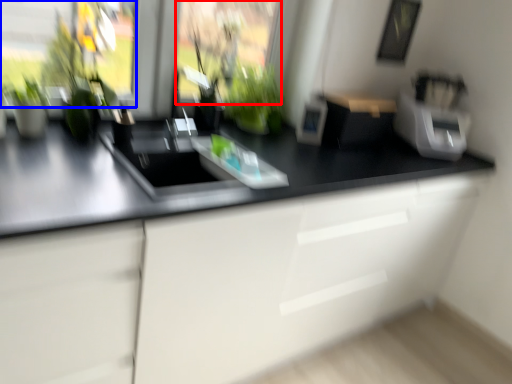
Question: Which object appears farthest to the camera in this image, window screen (highlighted by a red box) or window screen (highlighted by a blue box)?

Choices:
 (A) window screen
 (B) window screen

Answer: (A)